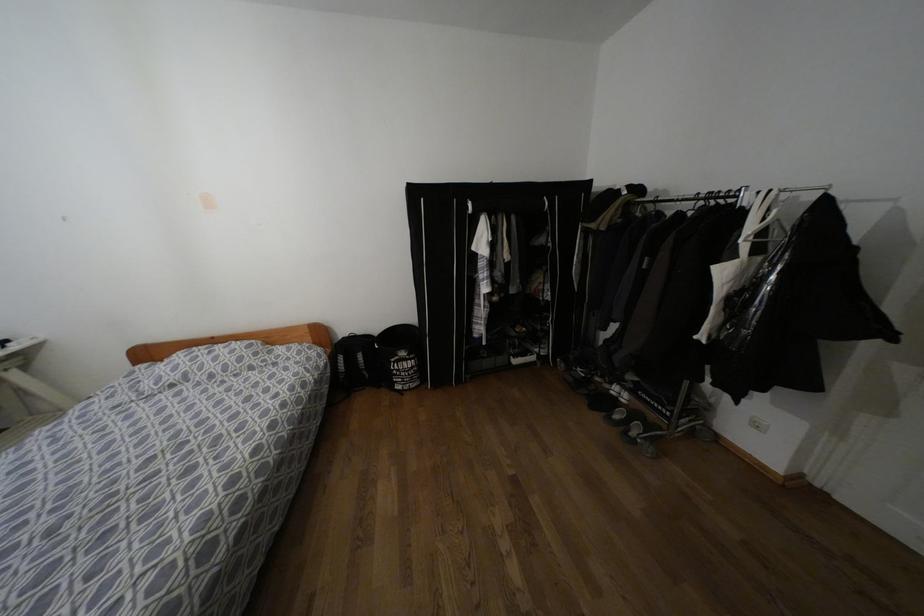
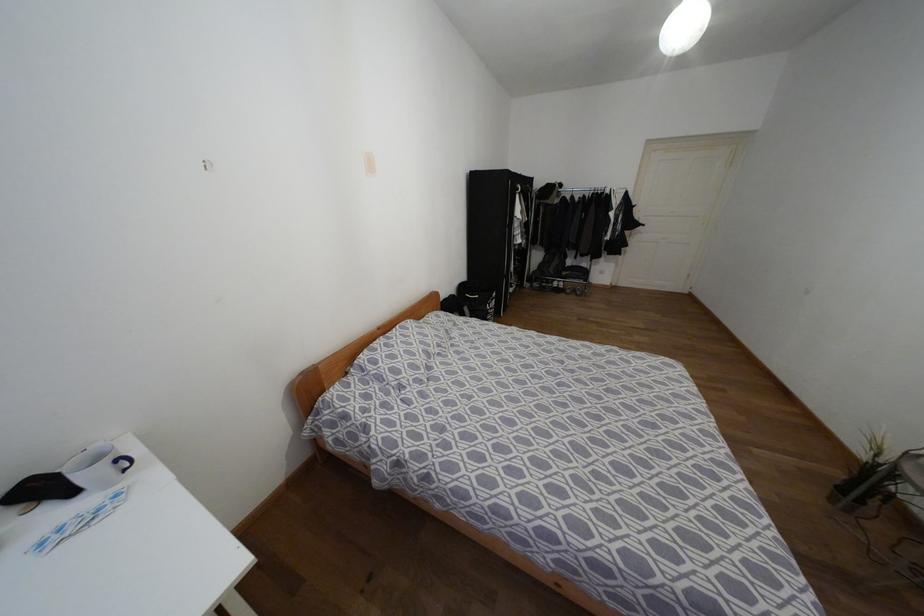
Locate, in the second image, the point that corresponds to [402,353] in the first image.

(493, 294)